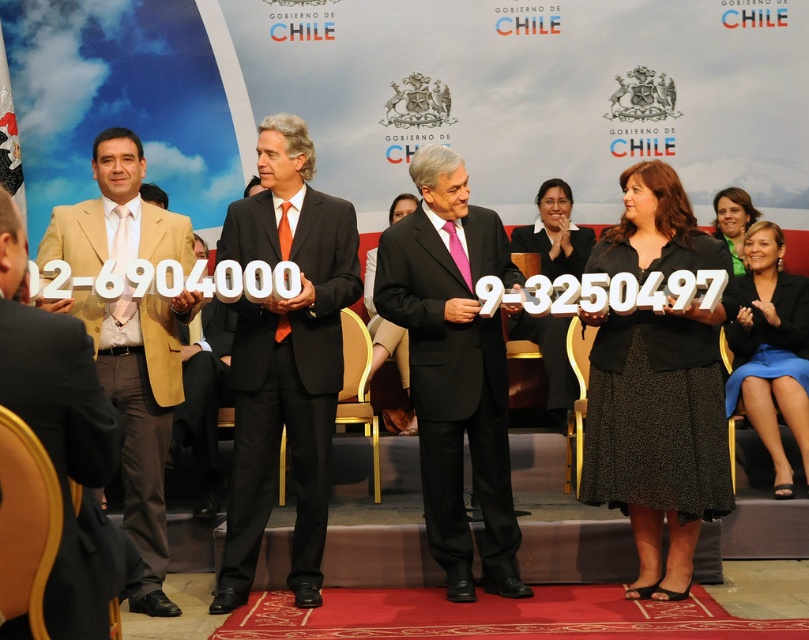
Which of these two, black dotted dress at right or matte black dress at center, stands taller?

matte black dress at center is taller.

Does black dotted dress at right have a greater width compared to matte black dress at center?

Correct, the width of black dotted dress at right exceeds that of matte black dress at center.

Describe the element at coordinates (657, 435) in the screenshot. This screenshot has height=640, width=809. I see `black dotted dress at right` at that location.

This screenshot has width=809, height=640. I want to click on black dotted dress at right, so click(x=657, y=435).

Is beige fabric suit at left shorter than black fabric dress at center?

No.

In the scene shown: Between beige fabric suit at left and black fabric dress at center, which one appears on the left side from the viewer's perspective?

Positioned to the left is beige fabric suit at left.

Does point (191, 307) come closer to viewer compared to point (579, 234)?

Yes.

The image size is (809, 640). What are the coordinates of `beige fabric suit at left` in the screenshot? It's located at (142, 416).

Is point (621, 378) closer to camera compared to point (332, 200)?

Yes, point (621, 378) is closer to viewer.

The image size is (809, 640). Find the location of `black dotted dress at right`. black dotted dress at right is located at coordinates (657, 435).

Find the location of a particular element. This screenshot has height=640, width=809. black dotted dress at right is located at coordinates (657, 435).